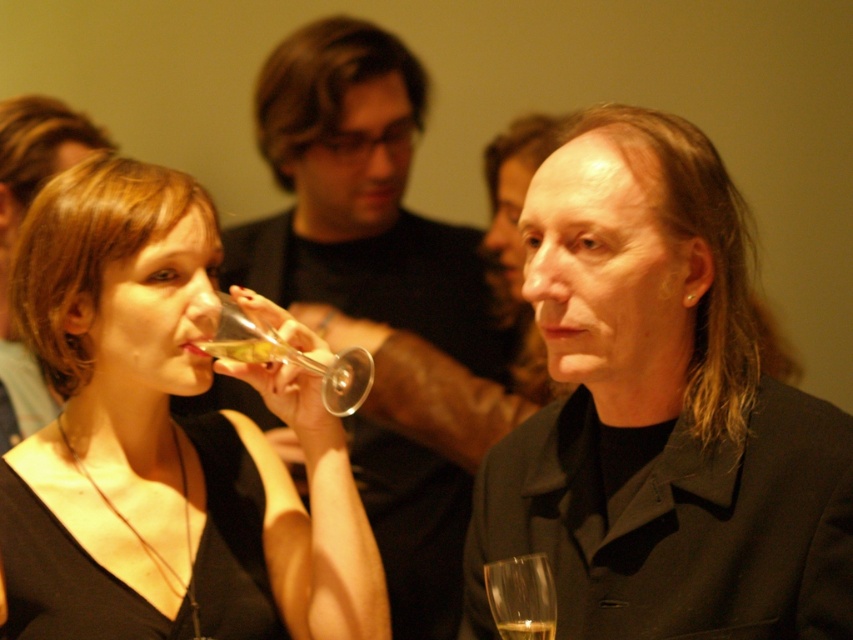
From the picture: You are a photographer at the event and want to ensure both the matte black dress at center and the translucent glass wine glass at upper center are clearly visible in your photo. Given their sizes, which object might require more careful framing to ensure it doesn not get lost in the composition?

The translucent glass wine glass at upper center is smaller than the matte black dress at center, so it might require more careful framing to ensure it doesn not get lost in the composition.

From the picture: You are a photographer at this event and want to capture the matte black dress at center and the translucent glass wine glass at upper center in the same frame. Which object should be placed closer to the left side of the camera frame to ensure both are visible?

The matte black dress at center should be placed closer to the left side of the camera frame because it is already positioned to the left of the translucent glass wine glass at upper center.

You are a photographer at this event and need to capture a photo where both the matte black jacket at center and the matte black dress at center are clearly visible. Given their positions, which object should you ensure is closer to the left side of the frame to include both in the shot?

The matte black dress at center should be positioned closer to the left side of the frame since the matte black jacket at center is on its right, allowing both to fit within the frame.